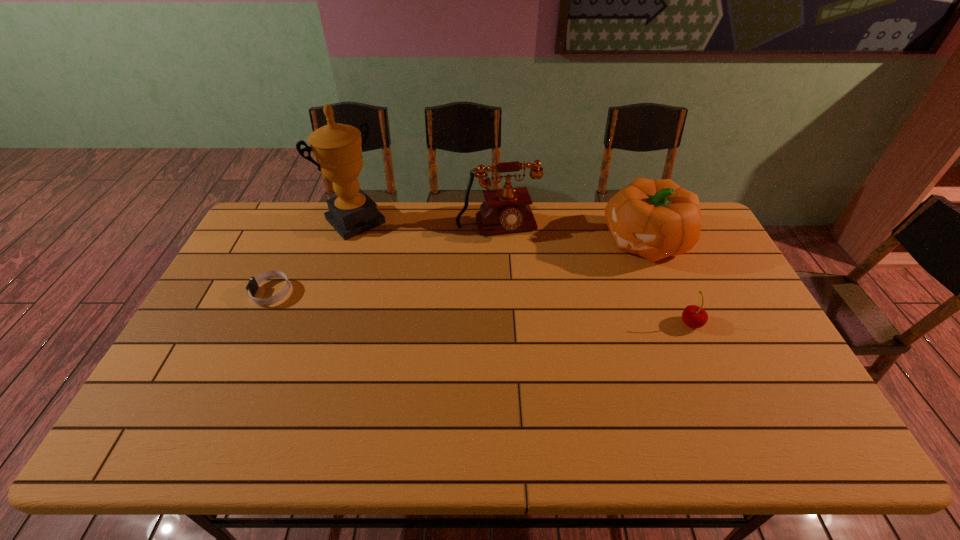
Locate an element on the screen. The width and height of the screenshot is (960, 540). vacant region located at the front of the award with handles is located at coordinates (416, 283).

The width and height of the screenshot is (960, 540). In order to click on free region located at the front of the award with handles in this screenshot , I will do `click(405, 272)`.

Locate an element on the screen. free space located on the carved face of the pumpkin is located at coordinates (571, 280).

Where is `vacant area located 0.340m on the carved face of the pumpkin`? vacant area located 0.340m on the carved face of the pumpkin is located at coordinates (533, 299).

Locate an element on the screen. free space located on the carved face of the pumpkin is located at coordinates (531, 300).

Where is `blank area located 0.250m on the dial of the third object from left to right`? Image resolution: width=960 pixels, height=540 pixels. blank area located 0.250m on the dial of the third object from left to right is located at coordinates (521, 295).

At what (x,y) coordinates should I click in order to perform the action: click on vacant region located 0.370m on the dial of the third object from left to right. Please return your answer as a coordinate pair (x, y). This screenshot has width=960, height=540. Looking at the image, I should click on (531, 326).

This screenshot has height=540, width=960. Find the location of `blank space located 0.090m on the dial of the third object from left to right`. blank space located 0.090m on the dial of the third object from left to right is located at coordinates (510, 259).

Identify the location of award that is positioned at the far edge. (337, 148).

Where is `pumpkin at the far edge`? pumpkin at the far edge is located at coordinates (655, 219).